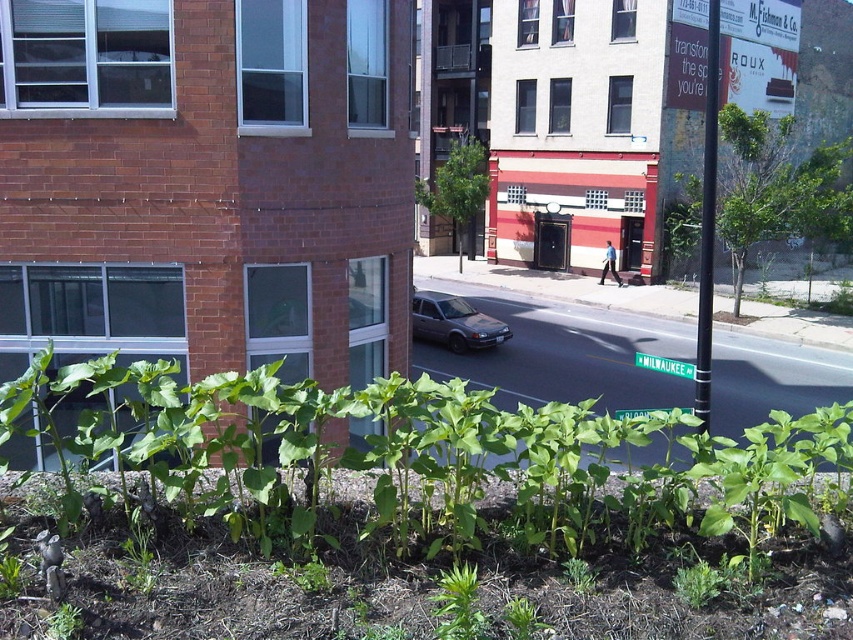
Can you confirm if satin silver sedan at center is positioned to the right of green plastic street sign at lower center?

Incorrect, satin silver sedan at center is not on the right side of green plastic street sign at lower center.

Can you confirm if satin silver sedan at center is smaller than green plastic street sign at lower center?

Yes, satin silver sedan at center is smaller than green plastic street sign at lower center.

Which is behind, point (495, 323) or point (664, 365)?

The point (495, 323) is more distant.

Find the location of a particular element. satin silver sedan at center is located at coordinates (454, 323).